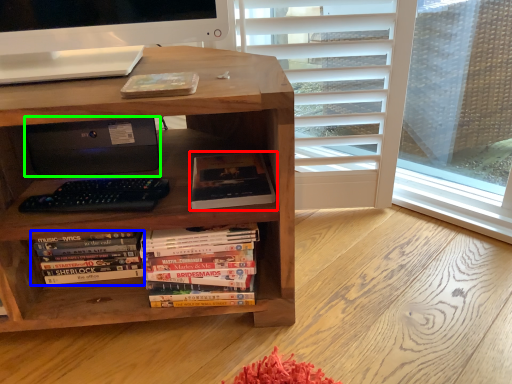
Question: Considering the real-world distances, which object is farthest from book (highlighted by a red box)? book (highlighted by a blue box) or printer (highlighted by a green box)?

Choices:
 (A) book
 (B) printer

Answer: (A)